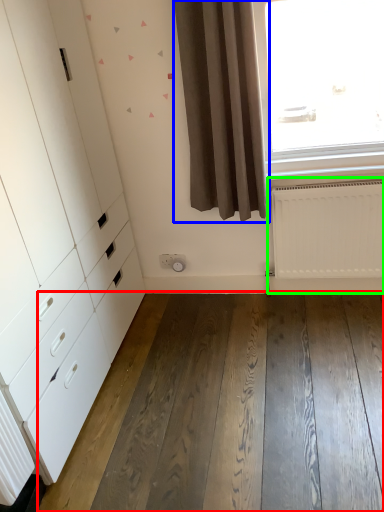
Question: Based on their relative distances, which object is nearer to hardwood (highlighted by a red box)? Choose from curtain (highlighted by a blue box) and radiator (highlighted by a green box).

Choices:
 (A) curtain
 (B) radiator

Answer: (B)